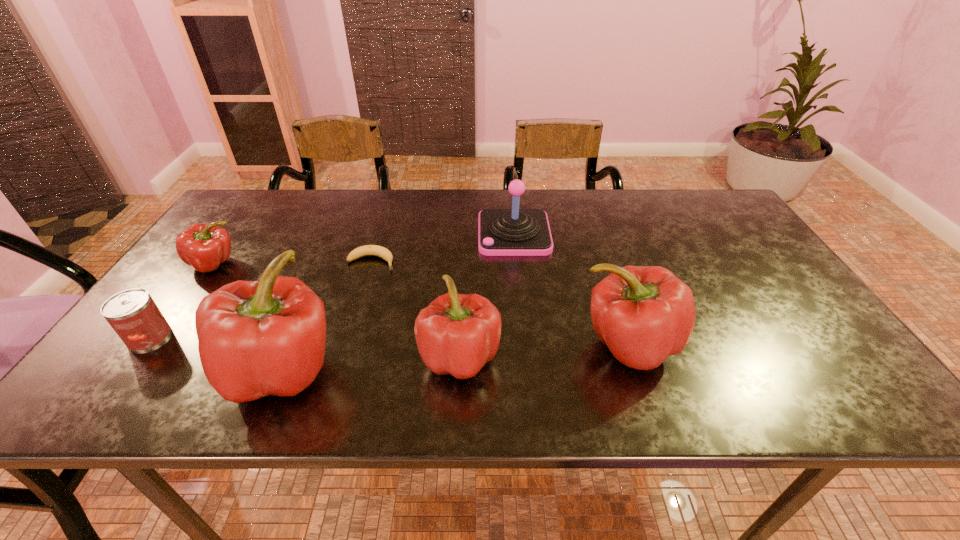
Please show where to add a bell pepper on the right while keeping spacing even. Please provide its 2D coordinates. Your answer should be formatted as a tuple, i.e. [(x, y)], where the tuple contains the x and y coordinates of a point satisfying the conditions above.

[(788, 334)]